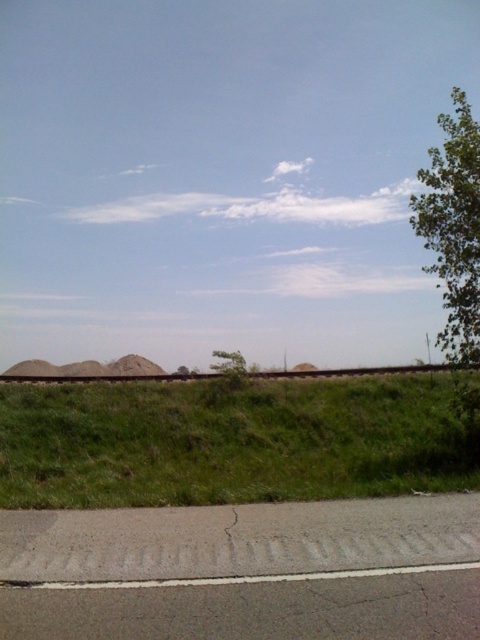
Question: Is green grassy hill at center closer to the viewer compared to green leafy tree at upper right?

Choices:
 (A) yes
 (B) no

Answer: (A)

Question: Which point is farther from the camera taking this photo?

Choices:
 (A) tap(457, 289)
 (B) tap(327, 387)

Answer: (B)

Question: Is green grassy hill at center positioned in front of green leafy tree at upper right?

Choices:
 (A) yes
 (B) no

Answer: (A)

Question: Does green grassy hill at center lie behind green leafy tree at upper right?

Choices:
 (A) yes
 (B) no

Answer: (B)

Question: Which of the following is the farthest from the observer?

Choices:
 (A) green grassy hill at center
 (B) green leafy tree at upper right

Answer: (B)